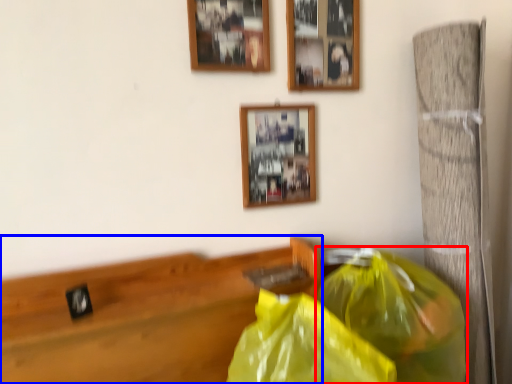
Question: Which object is further to the camera taking this photo, plastic bag (highlighted by a red box) or furniture (highlighted by a blue box)?

Choices:
 (A) plastic bag
 (B) furniture

Answer: (B)